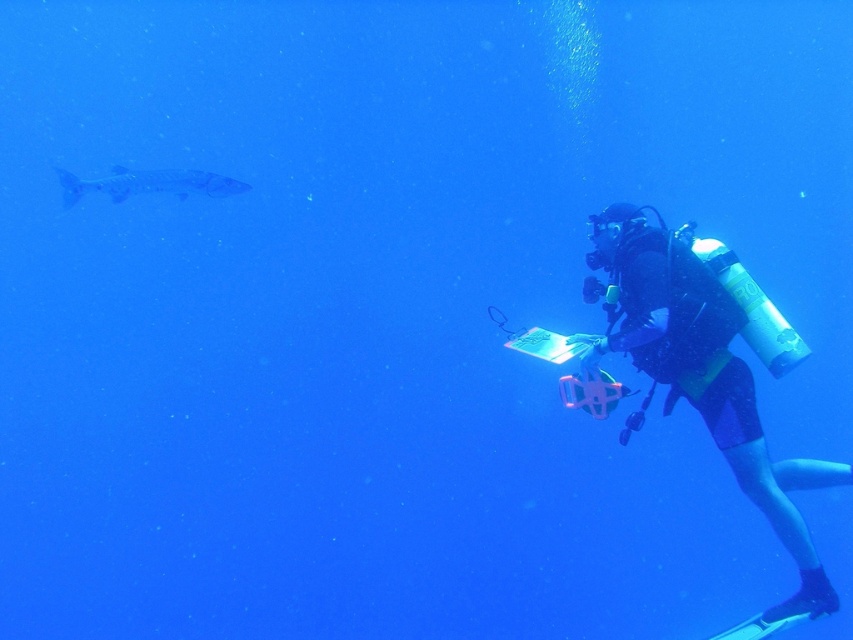
You are an underwater photographer aiming to capture a photo of both the black rubber wetsuit at right and the smooth blue fish at left. Since you want to include both in the frame, which object should you focus on first to ensure they are both in the shot?

You should focus on the black rubber wetsuit at right first because it is larger in size than the smooth blue fish at left, so by centering the larger object first, you can adjust the frame to include the smaller one.

You are a marine biologist observing an underwater scene. You see a black rubber wetsuit at right. If you need to reach it within 2 meters, can you do it?

The black rubber wetsuit at right is 3.53 meters away from the camera, so you cannot reach it within 2 meters.

You are an underwater photographer positioned at the center of the image. You want to capture a photo of the black rubber wetsuit at right. Based on the coordinates provided, in which direction should you aim your camera to ensure the wetsuit is centered in the frame?

The black rubber wetsuit at right is located at coordinates 0.589 on the x axis and 0.829 on the y axis. Since you are at the center, which is at coordinates 0.5, you should aim your camera slightly to the right and upwards to center the wetsuit in your frame.